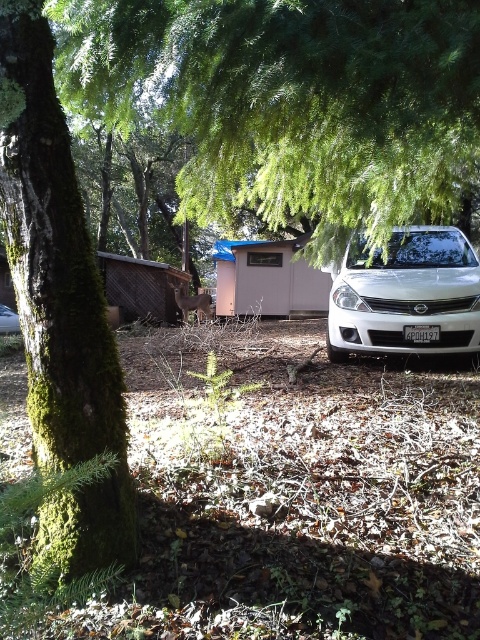
Which is above, white matte sedan at center or metallic silver car at center?

white matte sedan at center

Is white matte sedan at center bigger than metallic silver car at center?

Correct, white matte sedan at center is larger in size than metallic silver car at center.

Who is more distant from viewer, (452, 237) or (13, 323)?

Point (13, 323)

At what (x,y) coordinates should I click in order to perform the action: click on white matte sedan at center. Please return your answer as a coordinate pair (x, y). Looking at the image, I should click on (407, 296).

Which is more to the right, white matte shed at center or metallic silver car at center?

white matte shed at center is more to the right.

I want to click on white matte shed at center, so click(267, 280).

Is green mossy bark tree at left positioned before metallic silver car at center?

That is True.

Which is behind, point (63, 440) or point (12, 324)?

Point (12, 324)

The image size is (480, 640). I want to click on green mossy bark tree at left, so click(x=60, y=307).